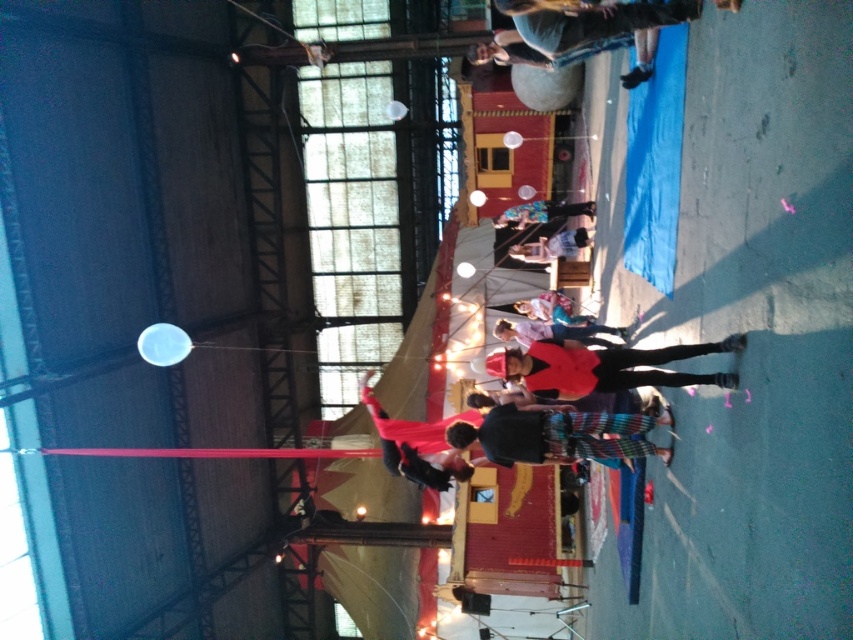
Question: Is velvet red cape at center to the left of light blue denim jeans at center from the viewer's perspective?

Choices:
 (A) no
 (B) yes

Answer: (B)

Question: Among these objects, which one is farthest from the camera?

Choices:
 (A) velvet red cape at center
 (B) light blue denim jeans at center

Answer: (B)

Question: Which of the following is the farthest from the observer?

Choices:
 (A) light blue denim jeans at center
 (B) velvet red cape at center

Answer: (A)

Question: Which point is closer to the camera?

Choices:
 (A) matte red jacket at center
 (B) velvet red cape at center
 (C) blue denim jeans at center
 (D) light blue denim jeans at center

Answer: (A)

Question: Does matte red jacket at center appear under blue denim jeans at center?

Choices:
 (A) no
 (B) yes

Answer: (B)

Question: Is matte red jacket at center positioned in front of light blue denim jeans at center?

Choices:
 (A) yes
 (B) no

Answer: (A)